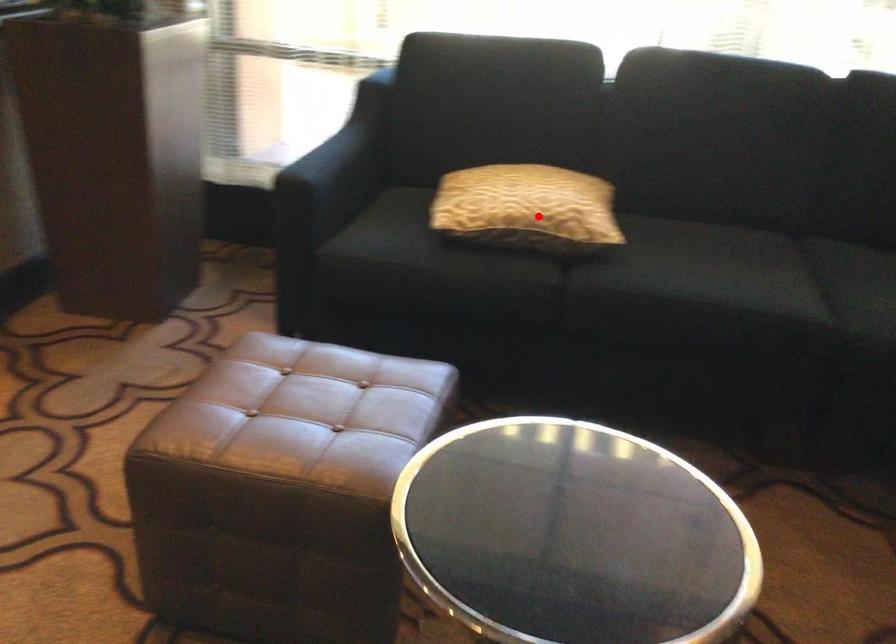
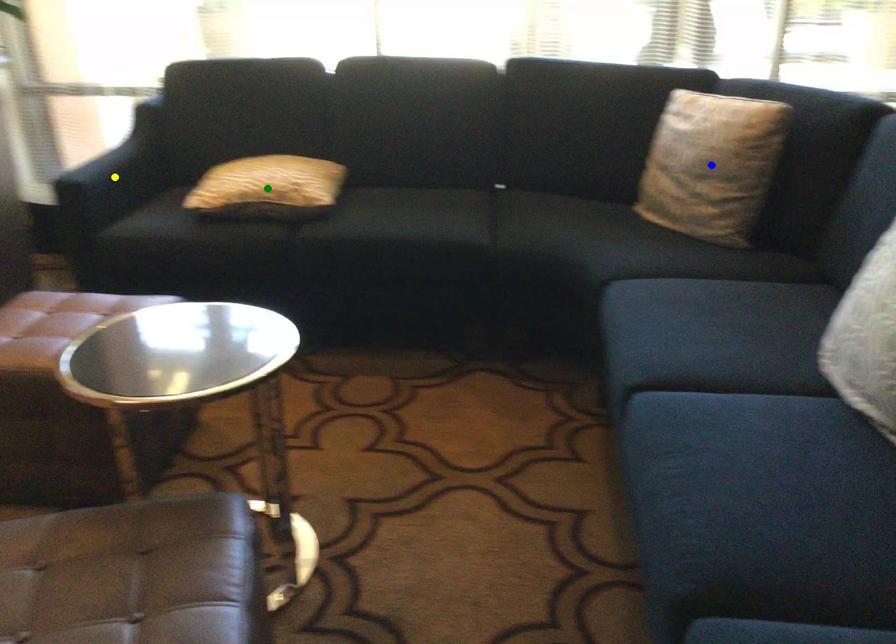
Question: I am providing you with two images of the same scene from different viewpoints. A red point is marked on the first image. You are given multiple points on the second image. Can you choose the point in image 2 that corresponds to the point in image 1?

Choices:
 (A) blue point
 (B) green point
 (C) yellow point

Answer: (B)